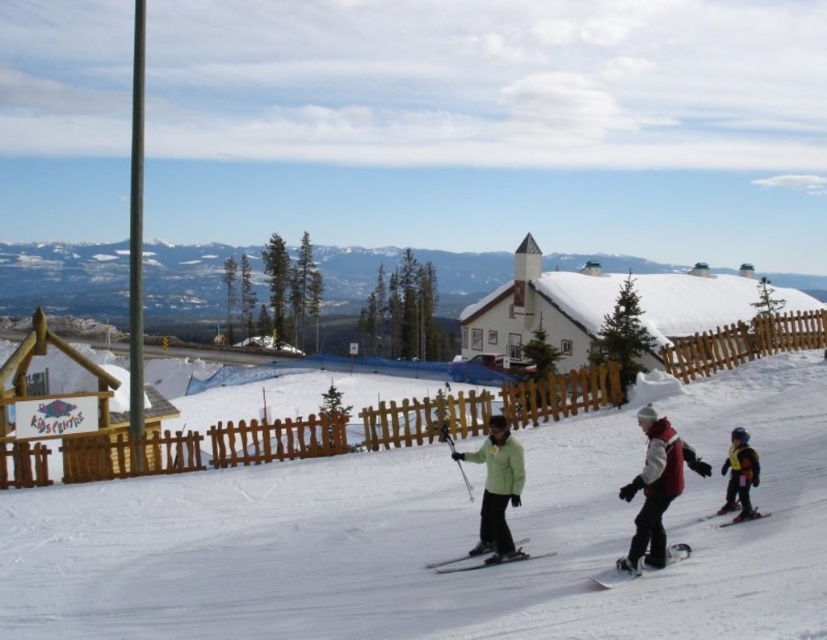
Question: Which point is closer to the camera?

Choices:
 (A) (484, 442)
 (B) (601, 582)
 (C) (708, 467)
 (D) (730, 518)

Answer: (B)

Question: Which of the following is the farthest from the observer?

Choices:
 (A) (275, 630)
 (B) (395, 440)
 (C) (651, 445)

Answer: (B)

Question: Among these objects, which one is nearest to the camera?

Choices:
 (A) green matte jacket at center
 (B) yellow life vest at lower right
 (C) white matte snowboard at lower center
 (D) maroon fleece jacket at center right

Answer: (C)

Question: Does white snow at center have a greater width compared to green matte jacket at center?

Choices:
 (A) no
 (B) yes

Answer: (B)

Question: Is green matte jacket at center thinner than white matte snowboard at lower center?

Choices:
 (A) no
 (B) yes

Answer: (A)

Question: Is black matte ski at center further to camera compared to black matte ski at lower right?

Choices:
 (A) yes
 (B) no

Answer: (B)